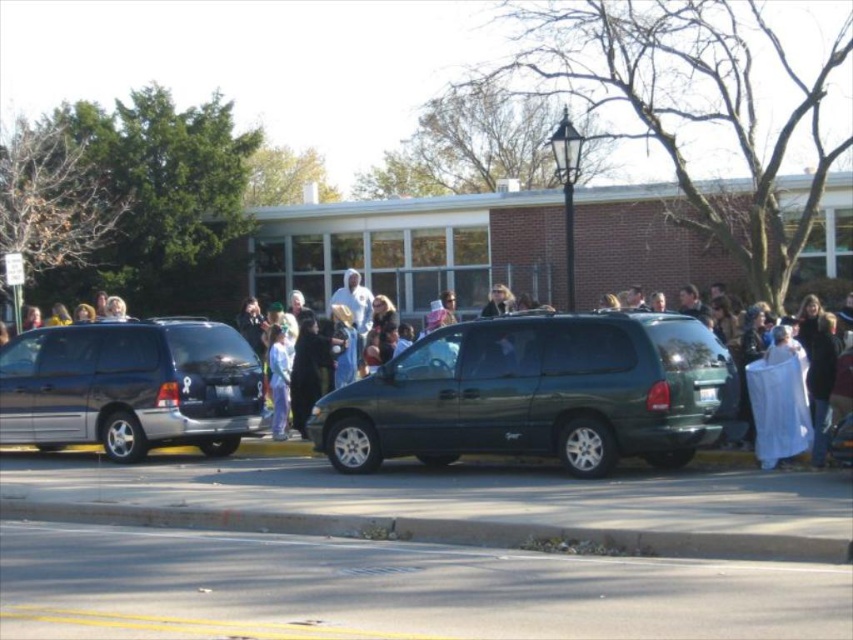
Can you confirm if matte black clothing at center is smaller than shiny metallic minivan at center?

No, matte black clothing at center is not smaller than shiny metallic minivan at center.

Can you confirm if matte black clothing at center is positioned below shiny metallic minivan at center?

Incorrect, matte black clothing at center is not positioned below shiny metallic minivan at center.

Find the location of `matte black clothing at center`. matte black clothing at center is located at coordinates (549, 388).

Identify the location of green matte van at center. (537, 394).

In the scene shown: Is green matte van at center wider than smooth concrete curb at lower center?

No, green matte van at center is not wider than smooth concrete curb at lower center.

You are a GUI agent. You are given a task and a screenshot of the screen. Output one action in this format:
    pyautogui.click(x=<x>, y=<y>)
    Task: Click on the green matte van at center
    Image resolution: width=853 pixels, height=640 pixels.
    Given the screenshot: What is the action you would take?
    pyautogui.click(x=537, y=394)

The width and height of the screenshot is (853, 640). Find the location of `green matte van at center`. green matte van at center is located at coordinates (537, 394).

Does matte black clothing at center have a lesser width compared to smooth concrete curb at lower center?

No, matte black clothing at center is not thinner than smooth concrete curb at lower center.

Is point (57, 349) positioned before point (561, 545)?

No.

You are a GUI agent. You are given a task and a screenshot of the screen. Output one action in this format:
    pyautogui.click(x=<x>, y=<y>)
    Task: Click on the matte black clothing at center
    The height and width of the screenshot is (640, 853).
    Given the screenshot: What is the action you would take?
    pyautogui.click(x=549, y=388)